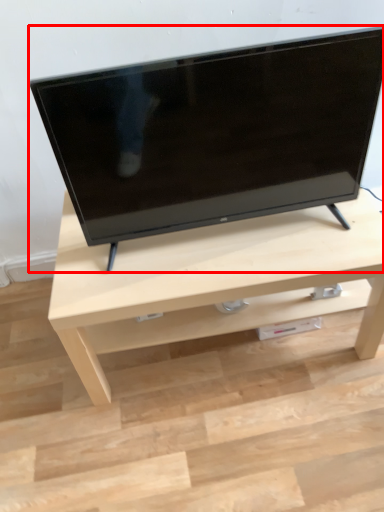
Question: From the image's perspective, what is the correct spatial relationship of television (annotated by the red box) in relation to table?

Choices:
 (A) below
 (B) above

Answer: (B)